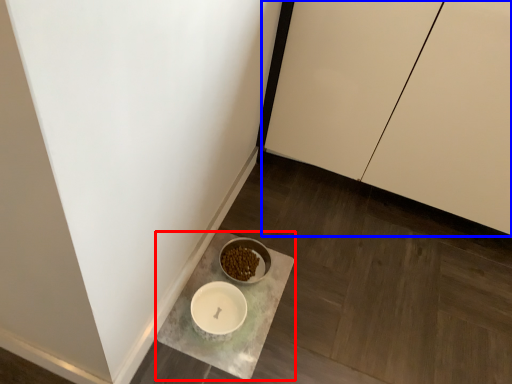
Question: Among these objects, which one is nearest to the camera, counter (highlighted by a red box) or cabinetry (highlighted by a blue box)?

Choices:
 (A) counter
 (B) cabinetry

Answer: (B)